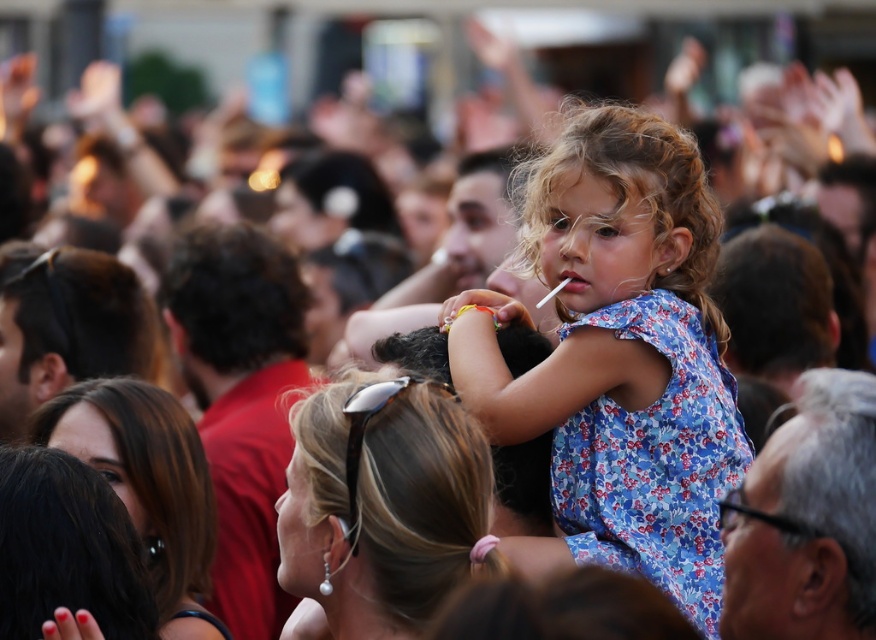
Which is in front, point (591, 317) or point (486, 301)?

Point (591, 317) is more forward.

Which is behind, point (668, 257) or point (520, 310)?

Positioned behind is point (520, 310).

Locate an element on the screen. The width and height of the screenshot is (876, 640). blue floral dress at center is located at coordinates (620, 358).

Who is shorter, dark brown hair at lower left or curly blonde hair at center?

With less height is dark brown hair at lower left.

Find the location of a particular element. Image resolution: width=876 pixels, height=640 pixels. dark brown hair at lower left is located at coordinates (67, 548).

Is brown shiny hair at center positioned at the back of curly blonde hair at center?

No, it is not.

Between point (460, 412) and point (655, 188), which one is positioned in front?

Positioned in front is point (655, 188).

Is point (364, 554) more distant than point (677, 180)?

No, (364, 554) is in front of (677, 180).

The image size is (876, 640). In order to click on brown shiny hair at center in this screenshot , I will do `click(380, 502)`.